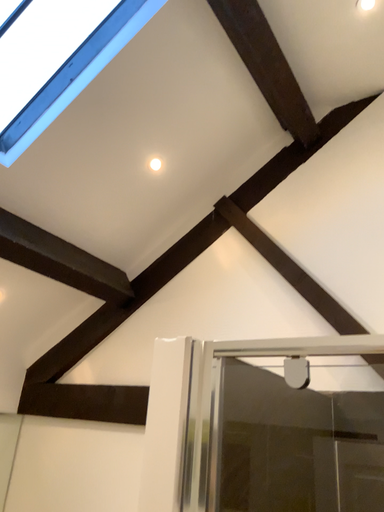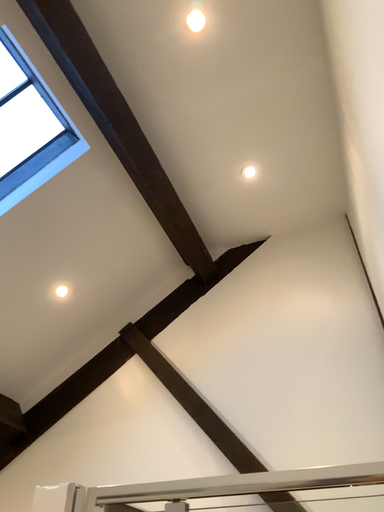
Question: Which way did the camera rotate in the video?

Choices:
 (A) rotated left
 (B) rotated right

Answer: (B)